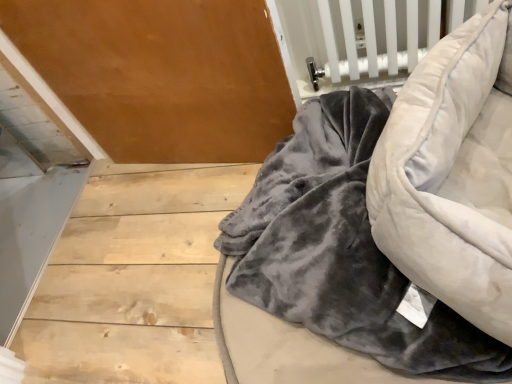
Question: Considering the positions of point (298, 380) and point (394, 201), is point (298, 380) closer or farther from the camera than point (394, 201)?

Choices:
 (A) farther
 (B) closer

Answer: (A)

Question: In the image, is velvet gray blanket at lower right positioned in front of or behind velvet gray bean bag chair at lower right?

Choices:
 (A) behind
 (B) front

Answer: (A)

Question: In terms of height, does velvet gray blanket at lower right look taller or shorter compared to velvet gray bean bag chair at lower right?

Choices:
 (A) short
 (B) tall

Answer: (A)

Question: In terms of height, does velvet gray bean bag chair at lower right look taller or shorter compared to velvet gray blanket at lower right?

Choices:
 (A) short
 (B) tall

Answer: (B)

Question: Is point (501, 190) closer or farther from the camera than point (232, 296)?

Choices:
 (A) farther
 (B) closer

Answer: (B)

Question: From the image's perspective, is velvet gray bean bag chair at lower right above or below velvet gray blanket at lower right?

Choices:
 (A) above
 (B) below

Answer: (A)

Question: Is velvet gray bean bag chair at lower right wider or thinner than velvet gray blanket at lower right?

Choices:
 (A) wide
 (B) thin

Answer: (B)